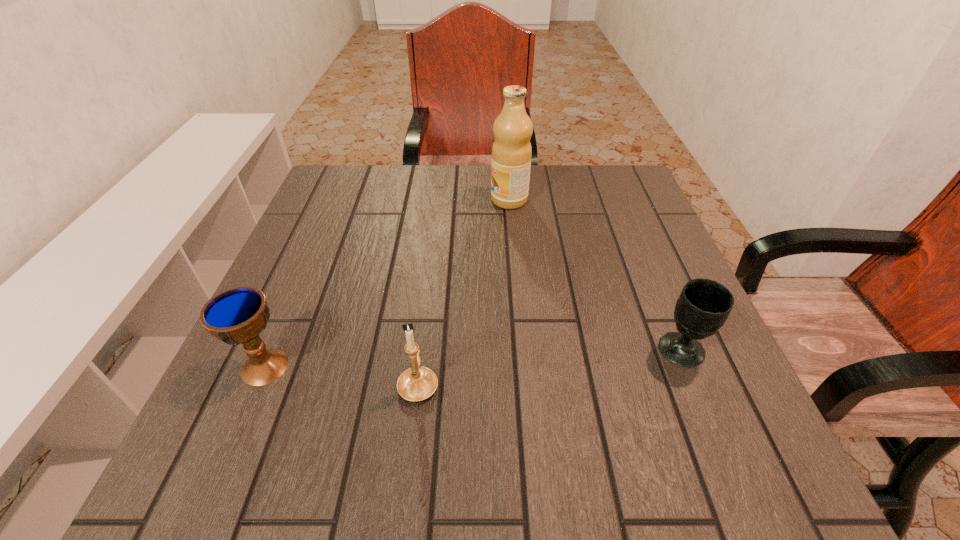
The height and width of the screenshot is (540, 960). Find the location of `free space between the left chalice and the candle holder`. free space between the left chalice and the candle holder is located at coordinates (342, 375).

Find the location of a particular element. Image resolution: width=960 pixels, height=540 pixels. unoccupied position between the tallest object and the rightmost object is located at coordinates (595, 275).

At what (x,y) coordinates should I click in order to perform the action: click on empty location between the farthest object and the rightmost object. Please return your answer as a coordinate pair (x, y). This screenshot has width=960, height=540. Looking at the image, I should click on (595, 275).

Identify which object is located as the second nearest to the left chalice. Please provide its 2D coordinates. Your answer should be formatted as a tuple, i.e. [(x, y)], where the tuple contains the x and y coordinates of a point satisfying the conditions above.

[(511, 152)]

Identify which object is located as the nearest to the third object from left to right. Please provide its 2D coordinates. Your answer should be formatted as a tuple, i.e. [(x, y)], where the tuple contains the x and y coordinates of a point satisfying the conditions above.

[(704, 305)]

Where is `free location that satisfies the following two spatial constraints: 1. on the back side of the right chalice; 2. on the label of the farthest object`? free location that satisfies the following two spatial constraints: 1. on the back side of the right chalice; 2. on the label of the farthest object is located at coordinates (619, 200).

Where is `free point that satisfies the following two spatial constraints: 1. on the back side of the rightmost object; 2. on the right side of the leftmost object`? This screenshot has width=960, height=540. free point that satisfies the following two spatial constraints: 1. on the back side of the rightmost object; 2. on the right side of the leftmost object is located at coordinates (272, 350).

I want to click on free space that satisfies the following two spatial constraints: 1. on the label of the rightmost object; 2. on the right side of the third object from left to right, so click(x=522, y=350).

Image resolution: width=960 pixels, height=540 pixels. Find the location of `free space that satisfies the following two spatial constraints: 1. on the label of the rightmost object; 2. on the left side of the farthest object`. free space that satisfies the following two spatial constraints: 1. on the label of the rightmost object; 2. on the left side of the farthest object is located at coordinates (522, 350).

Locate an element on the screen. The image size is (960, 540). blank space that satisfies the following two spatial constraints: 1. on the label of the right chalice; 2. on the left side of the olive oil is located at coordinates (522, 350).